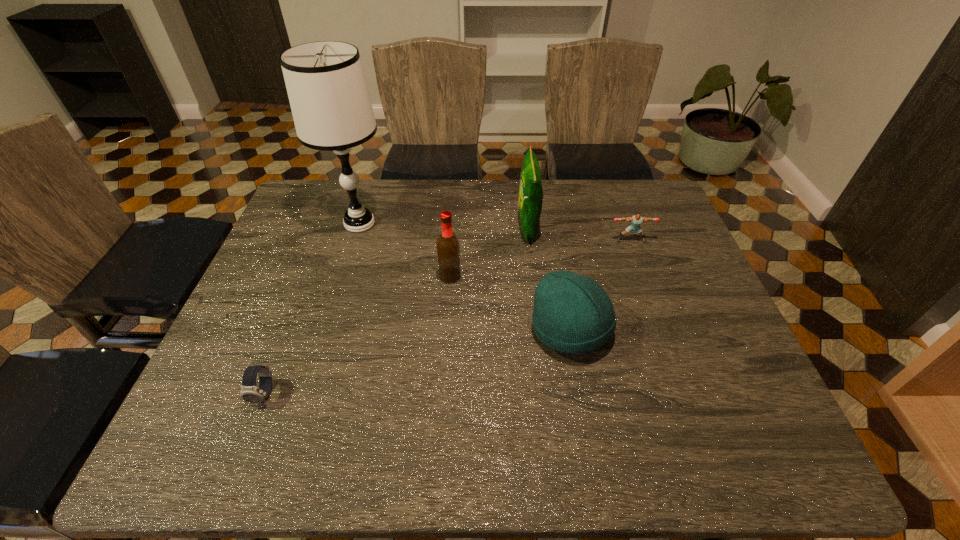
Find the location of `watch that is at the left edge`. watch that is at the left edge is located at coordinates (250, 392).

Find the location of a particular element. object that is at the right edge is located at coordinates (636, 220).

The height and width of the screenshot is (540, 960). What are the coordinates of `object at the far left corner` in the screenshot? It's located at (328, 94).

This screenshot has width=960, height=540. Find the location of `free space at the far edge of the desktop`. free space at the far edge of the desktop is located at coordinates (591, 219).

I want to click on vacant area at the near edge, so click(x=351, y=463).

You are a GUI agent. You are given a task and a screenshot of the screen. Output one action in this format:
    pyautogui.click(x=<x>, y=<y>)
    Task: Click on the free point at the left edge
    The height and width of the screenshot is (540, 960).
    Given the screenshot: What is the action you would take?
    pyautogui.click(x=215, y=401)

In the image, there is a desktop. Identify the location of free space at the right edge. The image size is (960, 540). (683, 294).

At what (x,y) coordinates should I click in order to perform the action: click on vacant space at the far left corner. Please return your answer as a coordinate pair (x, y). The height and width of the screenshot is (540, 960). Looking at the image, I should click on (328, 180).

Where is `vacant area at the far right corner of the desktop`? The height and width of the screenshot is (540, 960). vacant area at the far right corner of the desktop is located at coordinates (639, 203).

In the image, there is a desktop. Identify the location of free space at the near right corner. (764, 429).